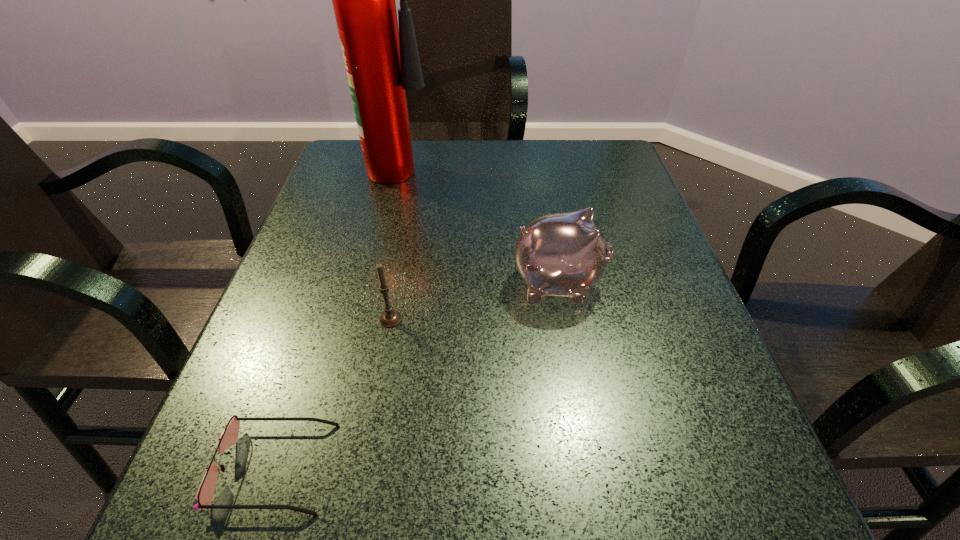
You are a GUI agent. You are given a task and a screenshot of the screen. Output one action in this format:
    pyautogui.click(x=<x>, y=<y>)
    Task: Click on the vacant area that lies between the shortest object and the tallest object
    This screenshot has height=540, width=960.
    Given the screenshot: What is the action you would take?
    pyautogui.click(x=338, y=315)

Find the location of a particular element. unoccupied area between the farthest object and the second shortest object is located at coordinates (396, 241).

This screenshot has height=540, width=960. I want to click on free space between the third tallest object and the rightmost object, so click(474, 301).

Choose which object is the nearest neighbor to the candle. Please provide its 2D coordinates. Your answer should be formatted as a tuple, i.e. [(x, y)], where the tuple contains the x and y coordinates of a point satisfying the conditions above.

[(204, 495)]

What are the coordinates of `object that stands as the second closest to the shortest object` in the screenshot? It's located at (563, 254).

The height and width of the screenshot is (540, 960). In order to click on vacant position in the image that satisfies the following two spatial constraints: 1. on the front facing side of the rightmost object; 2. at the nozzle of the fire extinguisher in this screenshot , I will do `click(537, 164)`.

You are a GUI agent. You are given a task and a screenshot of the screen. Output one action in this format:
    pyautogui.click(x=<x>, y=<y>)
    Task: Click on the vacant region that satisfies the following two spatial constraints: 1. on the back side of the candle; 2. at the nozzle of the tallest object
    
    Given the screenshot: What is the action you would take?
    pyautogui.click(x=420, y=164)

Locate an element on the screen. vacant space that satisfies the following two spatial constraints: 1. at the nozzle of the candle; 2. on the left side of the fire extinguisher is located at coordinates (365, 319).

At what (x,y) coordinates should I click in order to perform the action: click on vacant area that satisfies the following two spatial constraints: 1. at the nozzle of the tallest object; 2. on the front facing side of the piggy bank. Please return your answer as a coordinate pair (x, y). The width and height of the screenshot is (960, 540). Looking at the image, I should click on (373, 284).

Image resolution: width=960 pixels, height=540 pixels. I want to click on vacant space that satisfies the following two spatial constraints: 1. at the nozzle of the farthest object; 2. on the left side of the candle, so click(x=365, y=319).